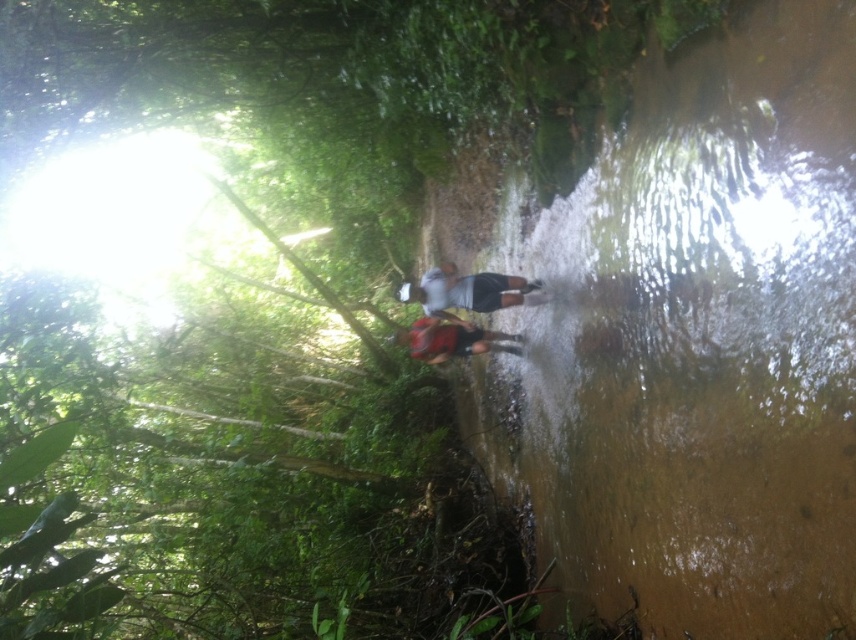
You are a hiker who wants to cross the stream safely. You notice the gray matte shirt at center and the red fabric backpack at center. How far apart are these two items in inches?

The gray matte shirt at center is 15.50 inches from the red fabric backpack at center.

You are a hiker who wants to cross the stream. There is a point marked by coordinates point (696, 342) in the middle of the stream. Is this point safe to step on?

The point (696, 342) is part of the brown murky water at center, which is shallow and muddy with calm flow, so it should be safe to step on as long as you take care due to the slippery conditions.